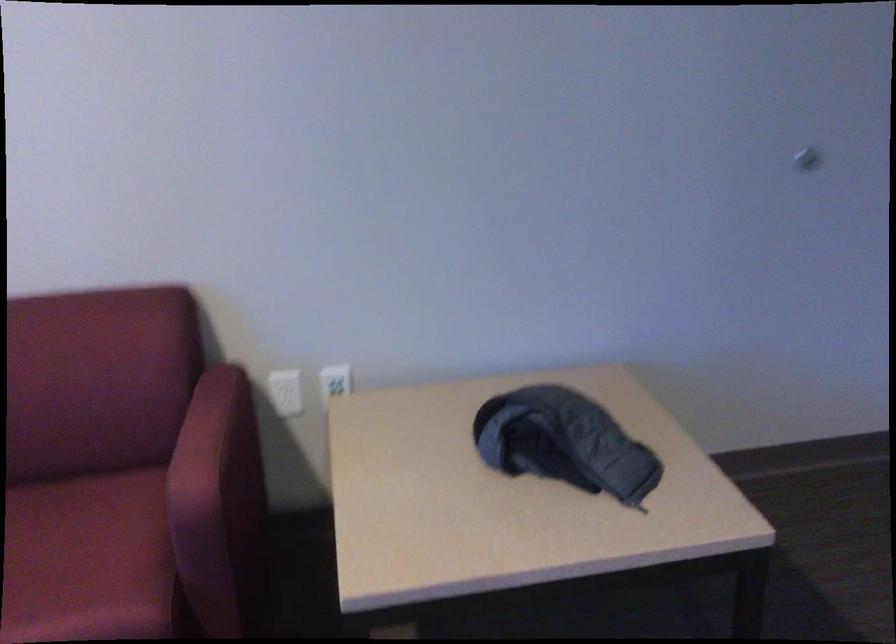
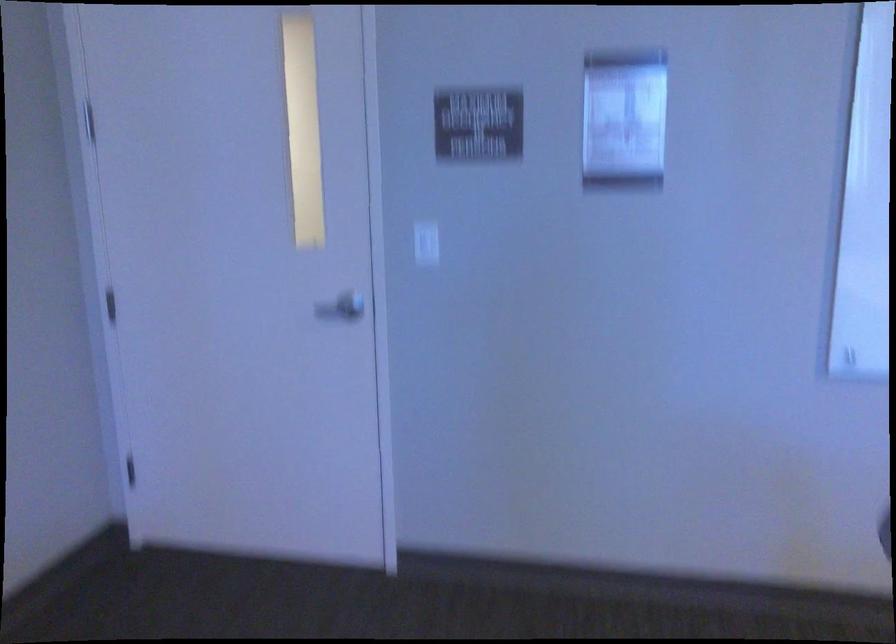
Question: The camera is either moving clockwise (left) or counter-clockwise (right) around the object. The first image is from the beginning of the video and the second image is from the end. Is the camera moving left or right when shooting the video?

Choices:
 (A) Left
 (B) Right

Answer: (A)